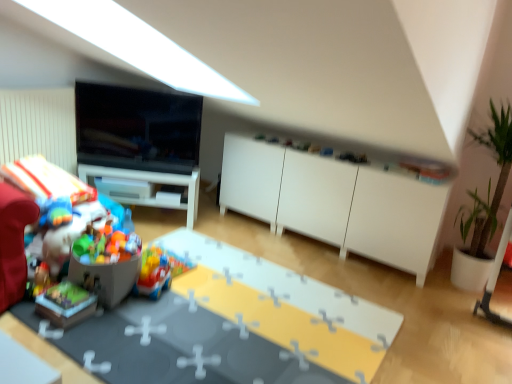
The width and height of the screenshot is (512, 384). In order to click on vacant space to the right of plastic colorful toys at lower left, marked as the second toy in a right-to-left arrangement in this screenshot , I will do `click(170, 302)`.